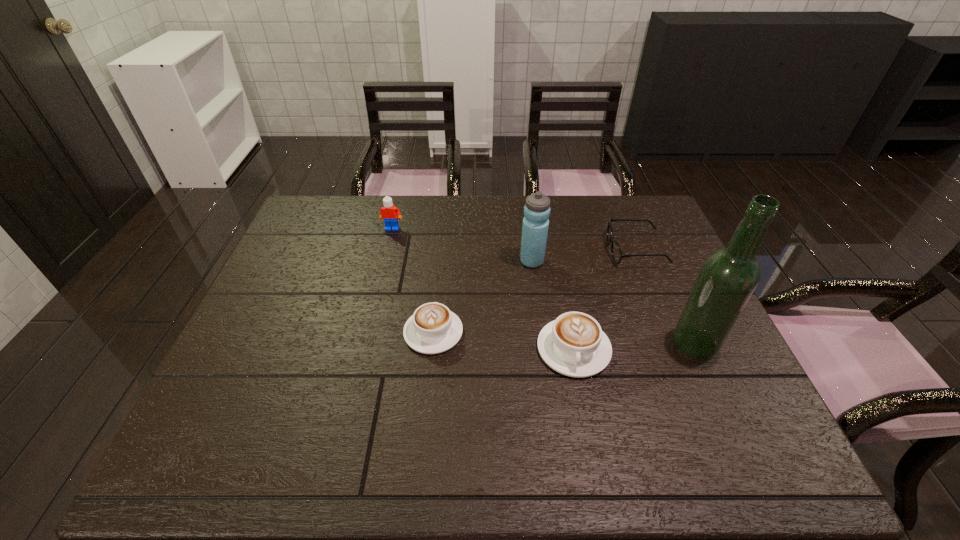
Locate an element on the screen. This screenshot has width=960, height=540. the fifth object from right to left is located at coordinates (432, 329).

Find the location of a particular element. Image resolution: width=960 pixels, height=540 pixels. the shorter cappuccino is located at coordinates (432, 329).

In order to click on the fourth tallest object in this screenshot , I will do `click(574, 344)`.

Find the location of a particular element. The width and height of the screenshot is (960, 540). the right cappuccino is located at coordinates (574, 344).

The height and width of the screenshot is (540, 960). Identify the location of the fourth shortest object. (389, 212).

Find the location of `the leftmost object`. the leftmost object is located at coordinates (389, 212).

Locate an element on the screen. Image resolution: width=960 pixels, height=540 pixels. spectacles is located at coordinates (616, 252).

Locate an element on the screen. the fifth shortest object is located at coordinates (535, 225).

This screenshot has height=540, width=960. Find the location of `the tallest object`. the tallest object is located at coordinates (728, 277).

Where is `free space located with the handle on the right side of the fifth object from right to left`? This screenshot has height=540, width=960. free space located with the handle on the right side of the fifth object from right to left is located at coordinates (441, 259).